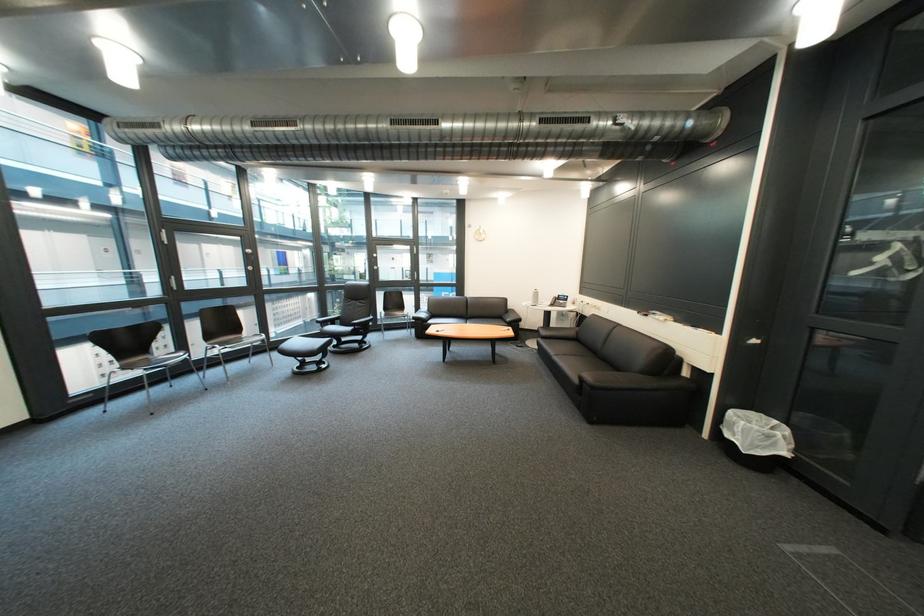
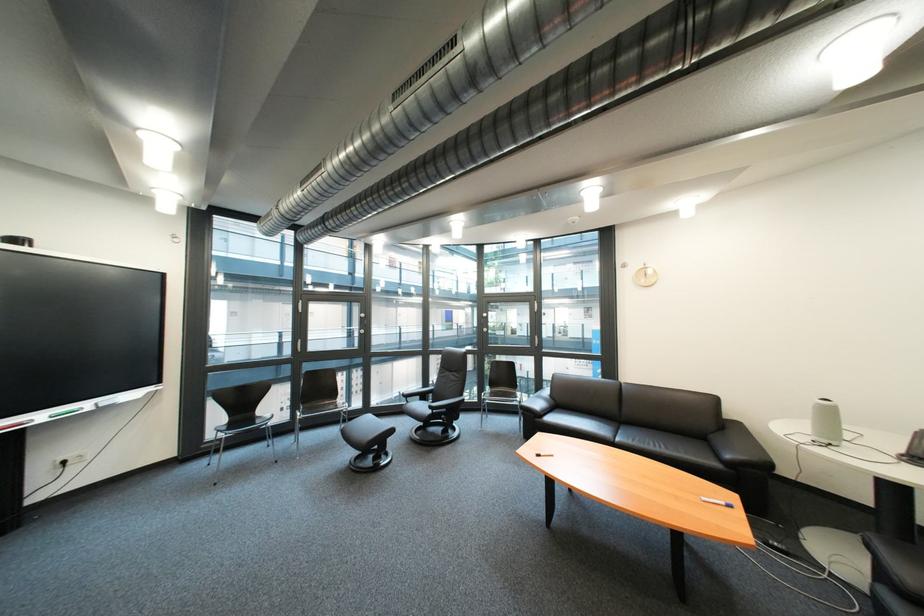
Find the pixel in the second image that matches pixel 515 331 in the first image.

(718, 501)